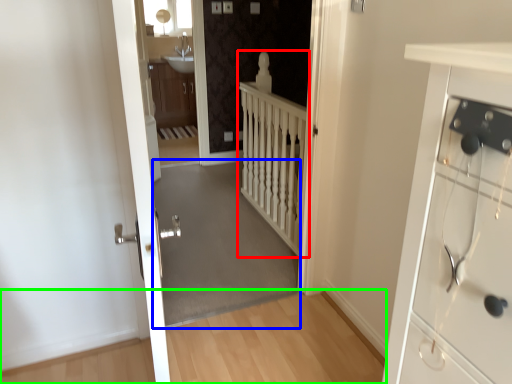
Question: Which is nearer to the balustrade (highlighted by a red box)? corridor (highlighted by a blue box) or path (highlighted by a green box).

Choices:
 (A) corridor
 (B) path

Answer: (A)